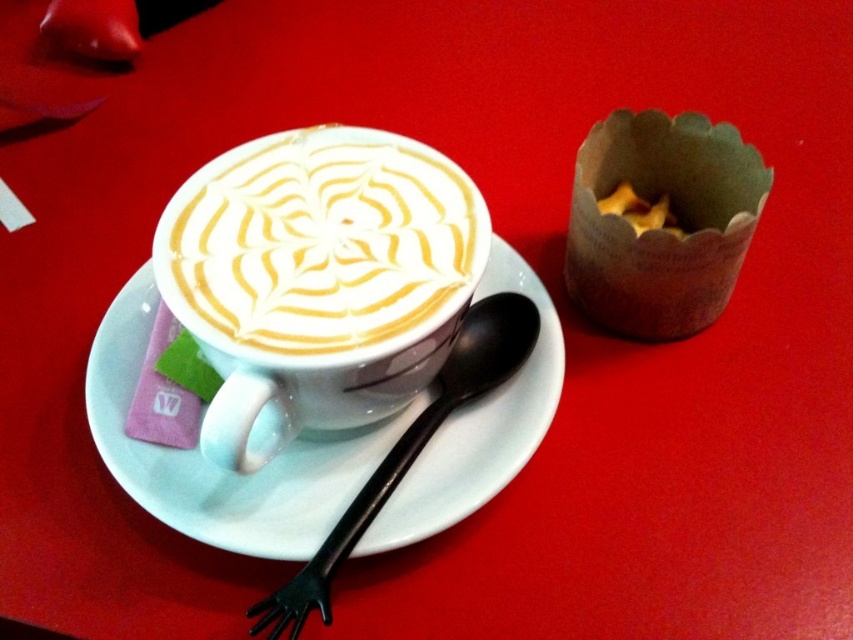
You are a barista arranging items on a table. The white glossy saucer at center is placed at coordinates 0.728, 0.254. If you want to place a new item exactly to the right of the saucer, where should you position it?

To place an item exactly to the right of the white glossy saucer at center, you should position it at coordinates approximately (216, 465) with an increased x or y coordinate depending on the coordinate system used. However, without knowing the specific coordinate system orientation, it is challenging to provide precise coordinates. Generally, moving right would mean increasing the x value if the coordinate system has x as horizontal and y as vertical.

You are a waiter who needs to place a dessert on the table. The dessert must be placed above the white glossy saucer at center. Is there enough space above it to place the dessert without overlapping the brown paper muffin at upper right?

The white glossy saucer at center is below the brown paper muffin at upper right, so placing the dessert above the saucer would mean it is positioned under the muffin. Since the muffin is already above the saucer, there might not be enough space to place the dessert without overlapping it.

You are a barista standing at the counter and want to reach the white glossy cup at center to add a topping. The barista can comfortably reach up to 34 inches. Is the cup within reach?

The white glossy cup at center is 34.51 inches away from the camera, which is slightly beyond the barista can comfortably reach up to 34 inches. Therefore, the cup is out of reach.